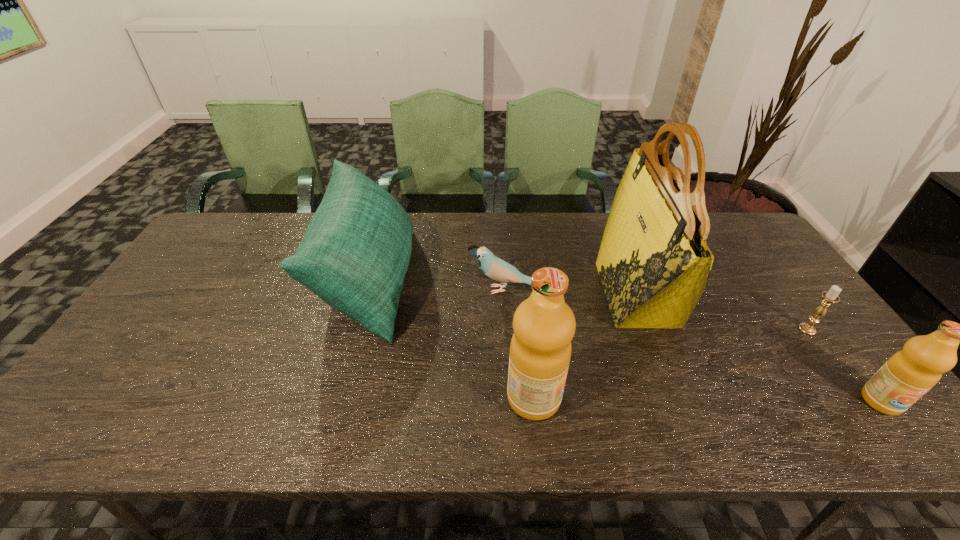
I want to click on candle holder at the right edge, so click(831, 296).

I want to click on object at the near right corner, so click(907, 375).

At what (x,y) coordinates should I click in order to perform the action: click on free space at the far edge of the desktop. Please return your answer as a coordinate pair (x, y). This screenshot has height=540, width=960. Looking at the image, I should click on click(451, 219).

The image size is (960, 540). In the image, there is a desktop. In order to click on vacant space at the near edge in this screenshot , I will do `click(632, 384)`.

Locate an element on the screen. vacant space at the right edge of the desktop is located at coordinates (755, 268).

In order to click on vacant space at the far left corner of the desktop in this screenshot , I will do `click(259, 230)`.

Locate an element on the screen. The height and width of the screenshot is (540, 960). vacant area that lies between the bird and the cushion is located at coordinates (438, 285).

Image resolution: width=960 pixels, height=540 pixels. Identify the location of vacant area that lies between the bird and the shorter fruit juice. (694, 345).

What are the coordinates of `vacant area that lies between the second tallest object and the cushion` in the screenshot? It's located at (451, 340).

Identify the location of free space between the taller fruit juice and the candle holder. (670, 364).